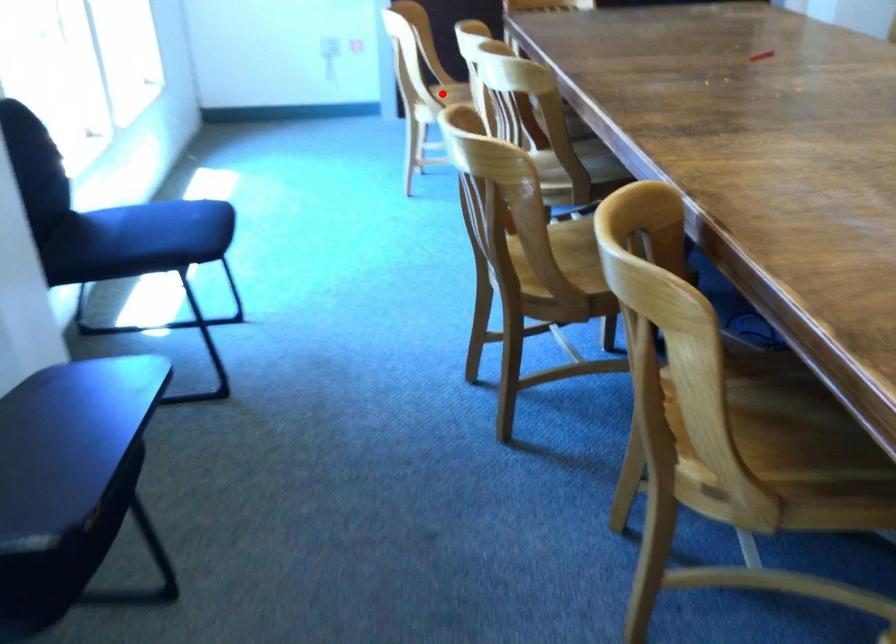
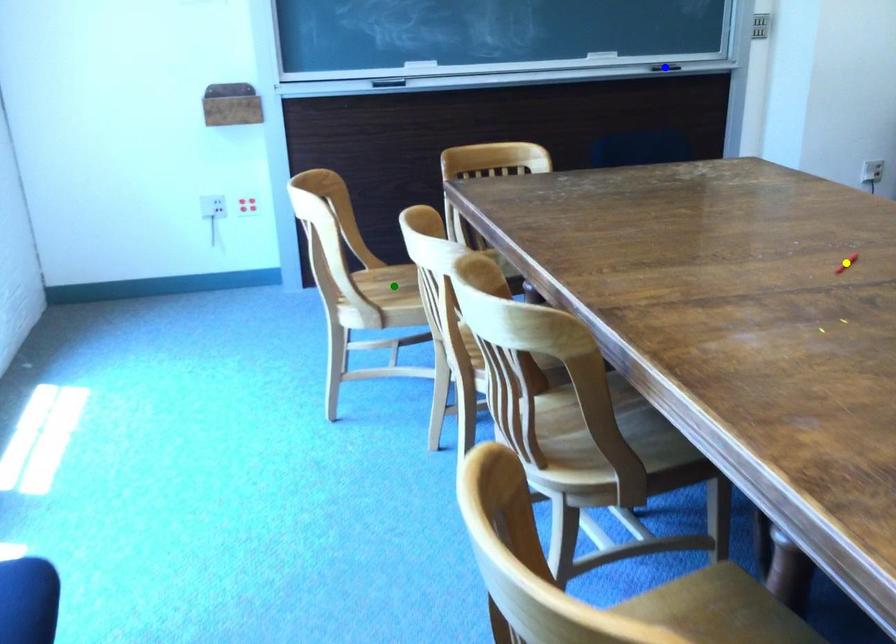
Question: I am providing you with two images of the same scene from different viewpoints. A red point is marked on the first image. You are given multiple points on the second image. Which point in image 2 represents the same 3d spot as the red point in image 1?

Choices:
 (A) blue point
 (B) yellow point
 (C) green point

Answer: (C)